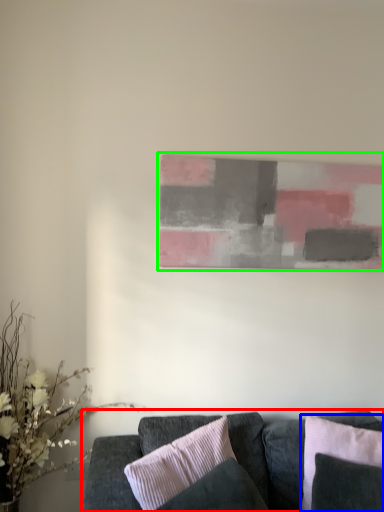
Question: Estimate the real-world distances between objects in this image. Which object is closer to studio couch (highlighted by a red box), pillow (highlighted by a blue box) or picture frame (highlighted by a green box)?

Choices:
 (A) pillow
 (B) picture frame

Answer: (A)